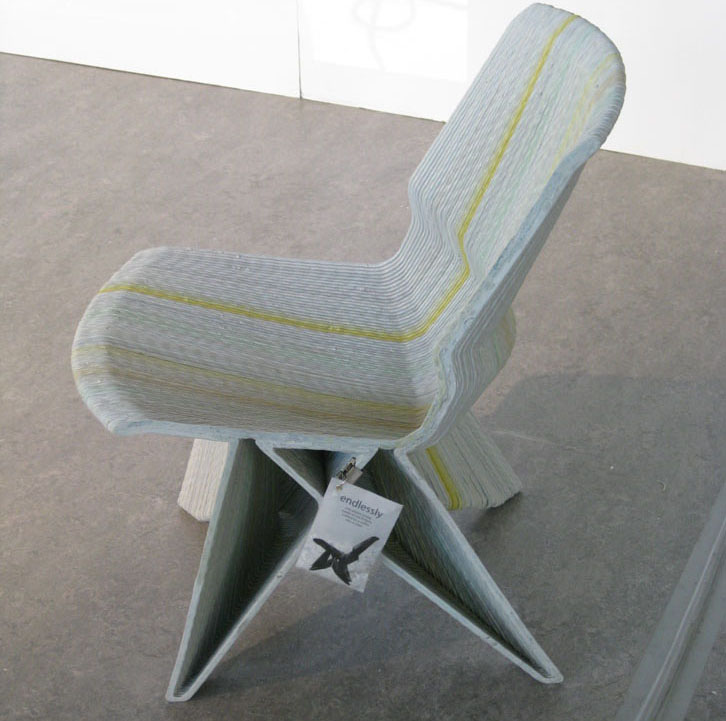
Where is `yellow strips on chair`? The image size is (726, 721). yellow strips on chair is located at coordinates (460, 226), (333, 398).